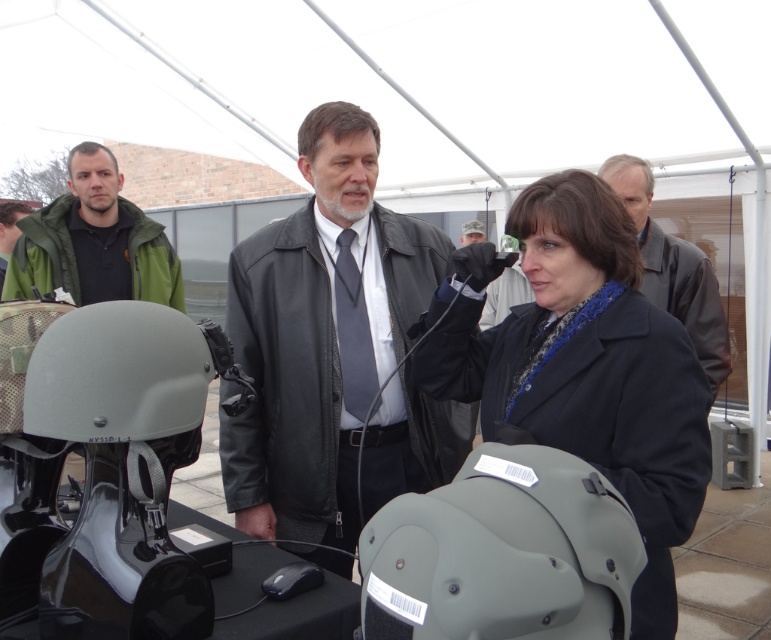
Who is lower down, matte black helmet at center or leather jacket at upper right?

Positioned lower is matte black helmet at center.

Is matte black helmet at center positioned at the back of leather jacket at upper right?

No.

Is point (586, 340) positioned after point (697, 276)?

No, it is in front of (697, 276).

Image resolution: width=771 pixels, height=640 pixels. Find the location of `matte black helmet at center`. matte black helmet at center is located at coordinates (581, 368).

Does black leather jacket at center have a larger size compared to leather jacket at upper right?

Yes.

I want to click on black leather jacket at center, so click(320, 333).

Where is `black leather jacket at center`? The width and height of the screenshot is (771, 640). black leather jacket at center is located at coordinates (320, 333).

Is point (369, 173) positioned before point (19, 237)?

Yes, it is.

The height and width of the screenshot is (640, 771). Find the location of `black leather jacket at center`. black leather jacket at center is located at coordinates (320, 333).